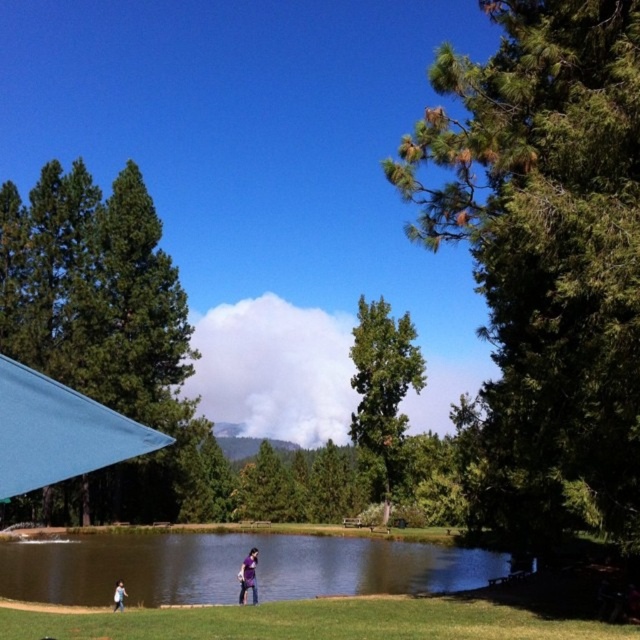
You are standing at the point labeled as point (547, 253) in the image. What is the nearest object to you in the scene?

The nearest object to you at point (547, 253) is the green textured tree at right, as the point is located on it.

You are a photographer trying to capture the two people walking near the pond. You notice the dark blue jeans at lower center and the light blue jeans at lower left. Which person is standing closer to the water edge?

The dark blue jeans at lower center is positioned on the right side of light blue jeans at lower left, so the person wearing dark blue jeans at lower center is standing closer to the water edge.